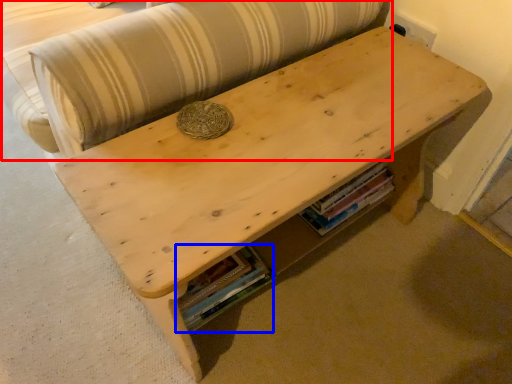
Question: Which object appears closest to the camera in this image, couch (highlighted by a red box) or book (highlighted by a blue box)?

Choices:
 (A) couch
 (B) book

Answer: (A)